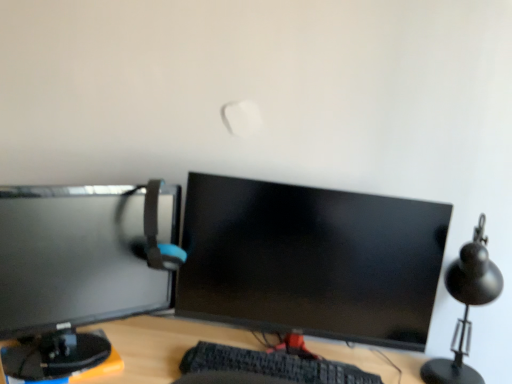
What is the approximate width of matte gray computer chair at left?

It is 4.26 inches.

What do you see at coordinates (466, 307) in the screenshot? I see `black matte table lamp at right` at bounding box center [466, 307].

The width and height of the screenshot is (512, 384). I want to click on black textured keyboard at center, so click(264, 367).

From a real-world perspective, which is physically below, black matte table lamp at right or black textured keyboard at center?

black textured keyboard at center is physically lower.

Is black matte table lamp at right not inside black textured keyboard at center?

Absolutely, black matte table lamp at right is external to black textured keyboard at center.

Is black matte table lamp at right to the right of black textured keyboard at center from the viewer's perspective?

Yes.

Considering the relative sizes of black matte table lamp at right and black textured keyboard at center in the image provided, is black matte table lamp at right taller than black textured keyboard at center?

Correct, black matte table lamp at right is much taller as black textured keyboard at center.

Is point (162, 269) farther from viewer compared to point (138, 223)?

Yes, point (162, 269) is behind point (138, 223).

Which object is thinner, matte gray computer chair at left or matte black monitor at left, the second computer monitor in the right-to-left sequence?

With smaller width is matte gray computer chair at left.

Which of these two, matte gray computer chair at left or matte black monitor at left, the second computer monitor in the right-to-left sequence, stands shorter?

Standing shorter between the two is matte gray computer chair at left.

From a real-world perspective, which object stands above the other?

matte black monitor at center, the 2th computer monitor positioned from the left, is physically above.

Is black matte table lamp at right wider or thinner than matte black monitor at center, marked as the 1th computer monitor in a right-to-left arrangement?

black matte table lamp at right is wider than matte black monitor at center, marked as the 1th computer monitor in a right-to-left arrangement.

Is black matte table lamp at right bigger or smaller than matte black monitor at center, marked as the 1th computer monitor in a right-to-left arrangement?

black matte table lamp at right is smaller than matte black monitor at center, marked as the 1th computer monitor in a right-to-left arrangement.

What's the angular difference between black matte table lamp at right and matte black monitor at center, marked as the 1th computer monitor in a right-to-left arrangement,'s facing directions?

The angular difference between black matte table lamp at right and matte black monitor at center, marked as the 1th computer monitor in a right-to-left arrangement, is 4.02e-05 degrees.

Between matte gray computer chair at left and matte black monitor at center, marked as the 1th computer monitor in a right-to-left arrangement, which one appears on the left side from the viewer's perspective?

matte gray computer chair at left is more to the left.

Which of these two, matte gray computer chair at left or matte black monitor at center, marked as the 1th computer monitor in a right-to-left arrangement, is wider?

With larger width is matte gray computer chair at left.

Is matte gray computer chair at left not close to matte black monitor at center, marked as the 1th computer monitor in a right-to-left arrangement?

They are positioned close to each other.

From the image's perspective, would you say matte black monitor at center, the 2th computer monitor positioned from the left, is shown under black textured keyboard at center?

No, from the image's perspective, matte black monitor at center, the 2th computer monitor positioned from the left, is not beneath black textured keyboard at center.

Is matte black monitor at center, the 2th computer monitor positioned from the left, not near black textured keyboard at center?

No, matte black monitor at center, the 2th computer monitor positioned from the left, is not far away from black textured keyboard at center.

Is matte black monitor at center, the 2th computer monitor positioned from the left, facing away from black textured keyboard at center?

No, matte black monitor at center, the 2th computer monitor positioned from the left,'s orientation is not away from black textured keyboard at center.

Between matte gray computer chair at left and black textured keyboard at center, which one has larger size?

matte gray computer chair at left.

Which is more distant, (148, 263) or (198, 365)?

The point (148, 263) is farther.

Which of these two, matte gray computer chair at left or black textured keyboard at center, is wider?

Wider between the two is black textured keyboard at center.

From the image's perspective, which object appears higher, matte gray computer chair at left or black matte table lamp at right?

matte gray computer chair at left appears higher in the image.

In the scene shown: Who is shorter, matte gray computer chair at left or black matte table lamp at right?

matte gray computer chair at left is shorter.

From a real-world perspective, which is physically above, matte gray computer chair at left or black matte table lamp at right?

From a 3D spatial view, matte gray computer chair at left is above.

What's the angular difference between matte gray computer chair at left and black matte table lamp at right's facing directions?

97.4 degrees.

Identify the location of table lamp above the black textured keyboard at center (from the image's perspective). (466, 307).

At what (x,y) coordinates should I click in order to perform the action: click on computer monitor that is on the left side of matte gray computer chair at left. Please return your answer as a coordinate pair (x, y). The width and height of the screenshot is (512, 384). Looking at the image, I should click on (81, 269).

Based on their spatial positions, is matte black monitor at left, arranged as the first computer monitor when viewed from the left, or matte gray computer chair at left further from black textured keyboard at center?

matte gray computer chair at left lies further to black textured keyboard at center than the other object.

Based on their spatial positions, is matte gray computer chair at left or matte black monitor at center, the 2th computer monitor positioned from the left, further from black matte table lamp at right?

Based on the image, matte gray computer chair at left appears to be further to black matte table lamp at right.

Which object lies further to the anchor point matte black monitor at left, the second computer monitor in the right-to-left sequence, black textured keyboard at center or black matte table lamp at right?

black matte table lamp at right lies further to matte black monitor at left, the second computer monitor in the right-to-left sequence, than the other object.

When comparing their distances from black textured keyboard at center, does matte gray computer chair at left or matte black monitor at left, the second computer monitor in the right-to-left sequence, seem closer?

matte black monitor at left, the second computer monitor in the right-to-left sequence.

Considering their positions, is black matte table lamp at right positioned closer to matte black monitor at center, marked as the 1th computer monitor in a right-to-left arrangement, than matte black monitor at left, arranged as the first computer monitor when viewed from the left?

Among the two, matte black monitor at left, arranged as the first computer monitor when viewed from the left, is located nearer to matte black monitor at center, marked as the 1th computer monitor in a right-to-left arrangement.

Estimate the real-world distances between objects in this image. Which object is closer to matte black monitor at center, marked as the 1th computer monitor in a right-to-left arrangement, matte gray computer chair at left or black matte table lamp at right?

matte gray computer chair at left lies closer to matte black monitor at center, marked as the 1th computer monitor in a right-to-left arrangement, than the other object.

Which object lies further to the anchor point matte black monitor at left, arranged as the first computer monitor when viewed from the left, black textured keyboard at center or matte gray computer chair at left?

black textured keyboard at center is further to matte black monitor at left, arranged as the first computer monitor when viewed from the left.

Considering their positions, is black matte table lamp at right positioned further to matte gray computer chair at left than black textured keyboard at center?

Based on the image, black matte table lamp at right appears to be further to matte gray computer chair at left.

Where is `computer keyboard located between matte gray computer chair at left and matte black monitor at center, marked as the 1th computer monitor in a right-to-left arrangement, in the left-right direction`? The image size is (512, 384). computer keyboard located between matte gray computer chair at left and matte black monitor at center, marked as the 1th computer monitor in a right-to-left arrangement, in the left-right direction is located at coordinates (264, 367).

Identify the location of computer keyboard located between matte black monitor at left, arranged as the first computer monitor when viewed from the left, and black matte table lamp at right in the left-right direction. (264, 367).

Where is `computer chair between matte black monitor at left, arranged as the first computer monitor when viewed from the left, and matte black monitor at center, marked as the 1th computer monitor in a right-to-left arrangement, from left to right`? The width and height of the screenshot is (512, 384). computer chair between matte black monitor at left, arranged as the first computer monitor when viewed from the left, and matte black monitor at center, marked as the 1th computer monitor in a right-to-left arrangement, from left to right is located at coordinates (157, 232).

Image resolution: width=512 pixels, height=384 pixels. I want to click on computer monitor located between matte black monitor at left, the second computer monitor in the right-to-left sequence, and black matte table lamp at right in the left-right direction, so pos(311,260).